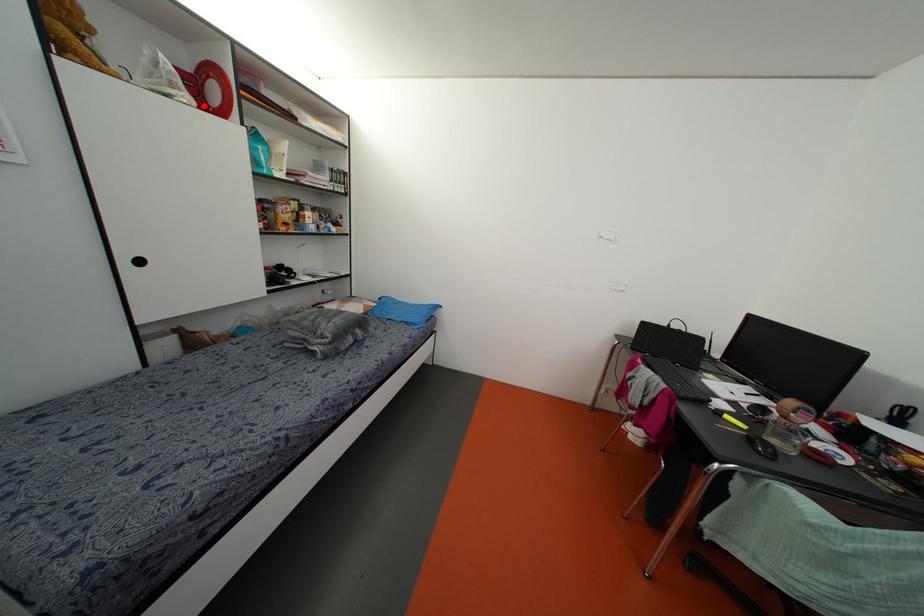
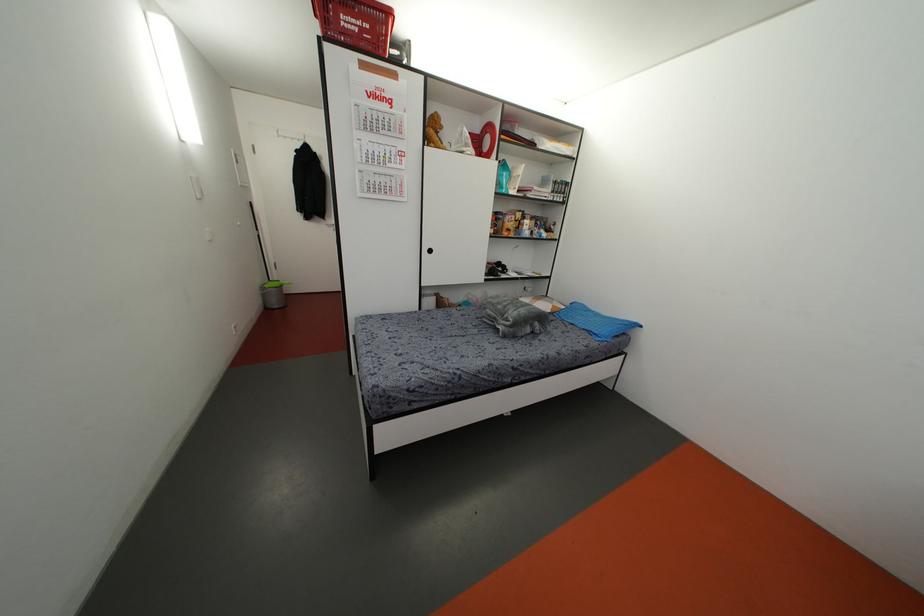
In the second image, find the point that corresponds to the highlighted location in the first image.

(479, 153)